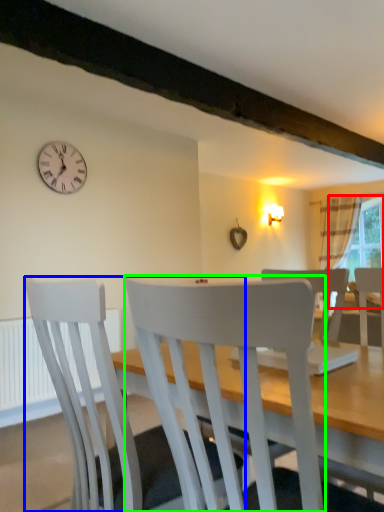
Question: Which object is positioned closest to window screen (highlighted by a red box)? Select from chair (highlighted by a blue box) and chair (highlighted by a green box).

Choices:
 (A) chair
 (B) chair

Answer: (A)